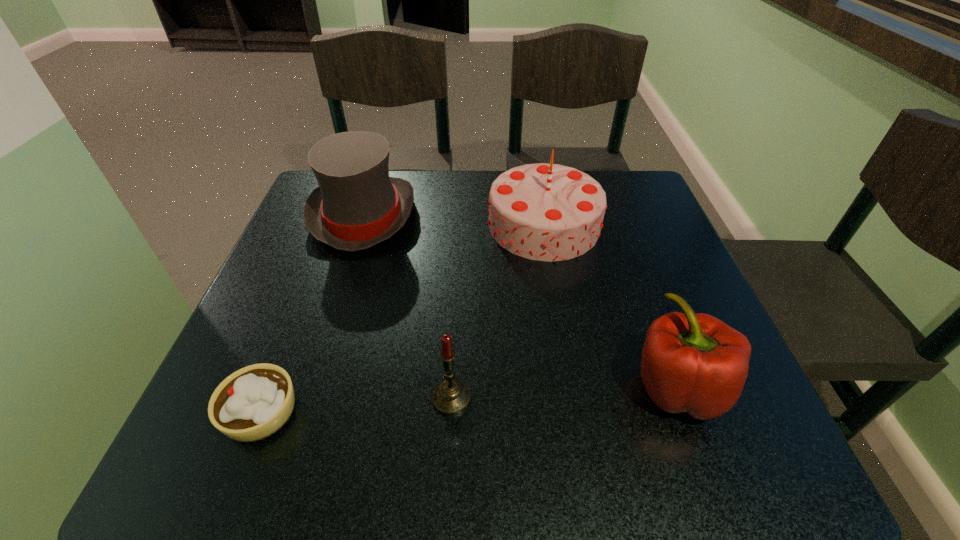
I want to click on birthday cake at the far edge, so click(547, 212).

Where is `dress hat that is positioned at the far edge`? dress hat that is positioned at the far edge is located at coordinates (357, 205).

Locate an element on the screen. The width and height of the screenshot is (960, 540). bell pepper located at the near edge is located at coordinates (695, 363).

At what (x,y) coordinates should I click in order to perform the action: click on whipped cream that is at the near edge. Please return your answer as a coordinate pair (x, y). The width and height of the screenshot is (960, 540). Looking at the image, I should click on (254, 402).

At what (x,y) coordinates should I click in order to perform the action: click on dress hat at the left edge. Please return your answer as a coordinate pair (x, y). The image size is (960, 540). Looking at the image, I should click on (357, 205).

What are the coordinates of `whipped cream that is at the left edge` in the screenshot? It's located at (254, 402).

The height and width of the screenshot is (540, 960). Find the location of `birthday cake at the right edge`. birthday cake at the right edge is located at coordinates (547, 212).

At what (x,y) coordinates should I click in order to perform the action: click on bell pepper present at the right edge. Please return your answer as a coordinate pair (x, y). Looking at the image, I should click on (695, 363).

Where is `object that is positioned at the far left corner`? This screenshot has width=960, height=540. object that is positioned at the far left corner is located at coordinates (357, 205).

What are the coordinates of `object located at the near left corner` in the screenshot? It's located at (254, 402).